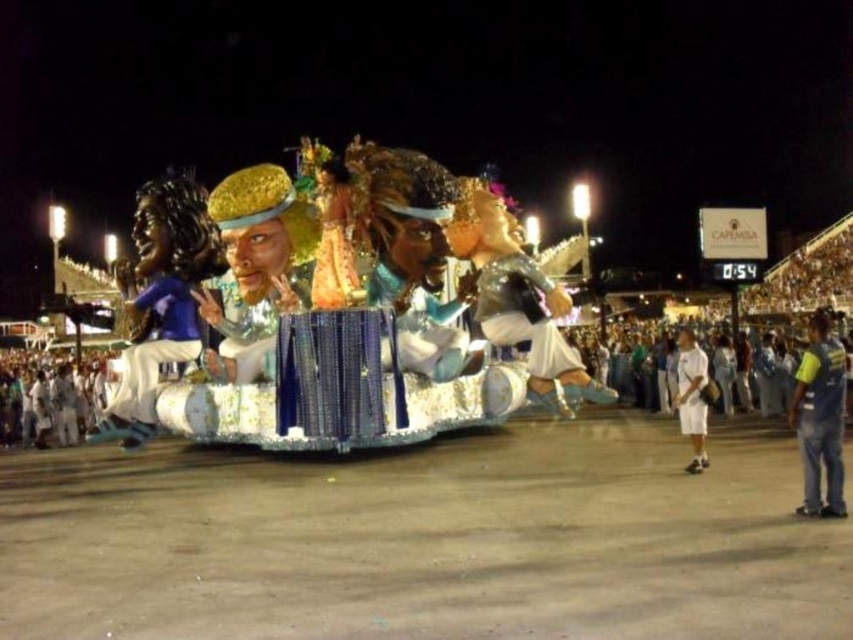
This screenshot has width=853, height=640. Describe the element at coordinates (820, 417) in the screenshot. I see `blue jeans at lower right` at that location.

Find the location of a particular element. This screenshot has height=640, width=853. blue jeans at lower right is located at coordinates click(820, 417).

Can you confirm if shiny silver costume at center is wider than matte blue fabric at left?

In fact, shiny silver costume at center might be narrower than matte blue fabric at left.

The image size is (853, 640). Identify the location of shiny silver costume at center. (521, 314).

Describe the element at coordinates (521, 314) in the screenshot. I see `shiny silver costume at center` at that location.

Locate an element on the screen. This screenshot has height=640, width=853. shiny silver costume at center is located at coordinates (521, 314).

Who is lower down, shiny blue fabric at center or matte blue fabric at left?

matte blue fabric at left is below.

Does shiny blue fabric at center appear under matte blue fabric at left?

Actually, shiny blue fabric at center is above matte blue fabric at left.

Which is in front, point (461, 276) or point (190, 298)?

Positioned in front is point (190, 298).

Locate an element on the screen. shiny blue fabric at center is located at coordinates (425, 323).